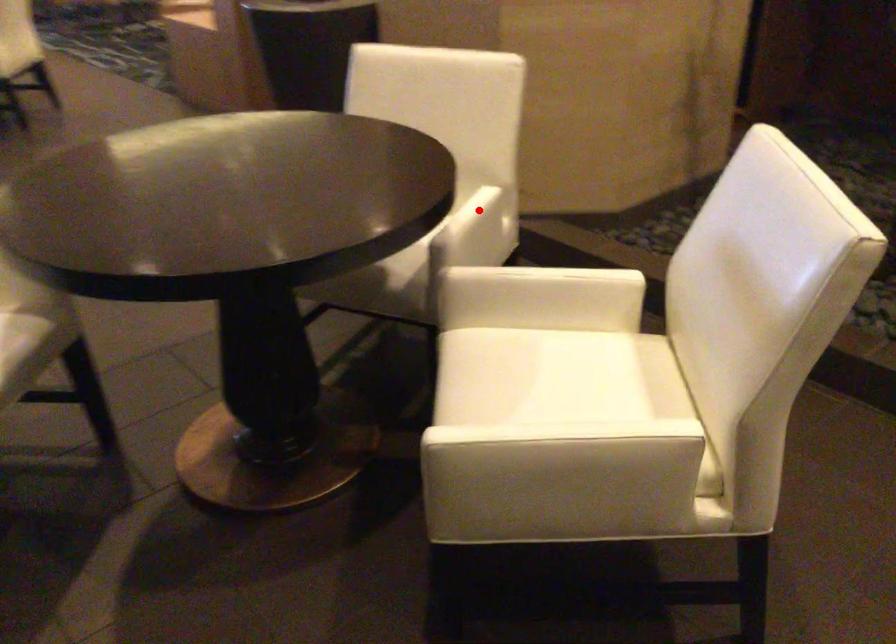
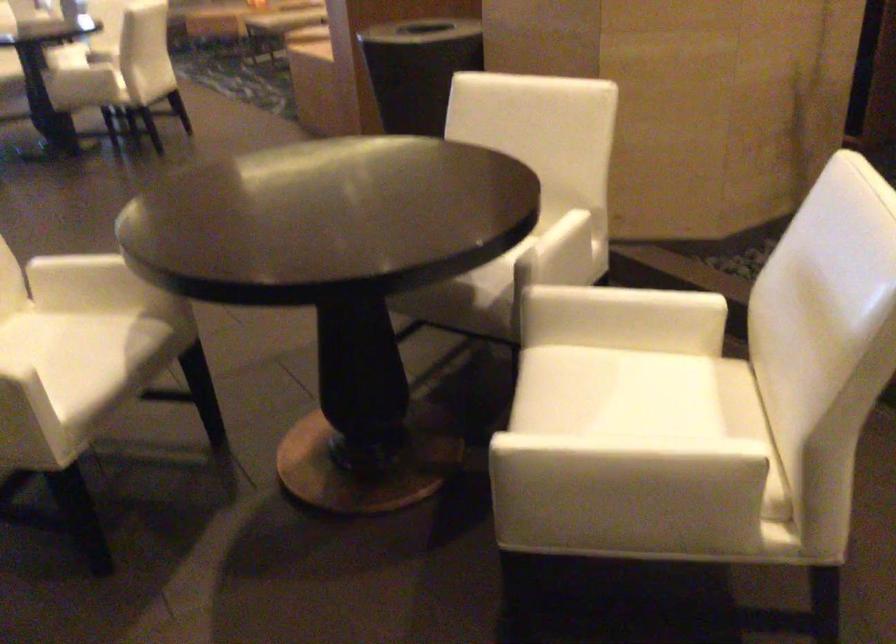
Locate, in the second image, the point that corresponds to the highlighted location in the first image.

(567, 232)